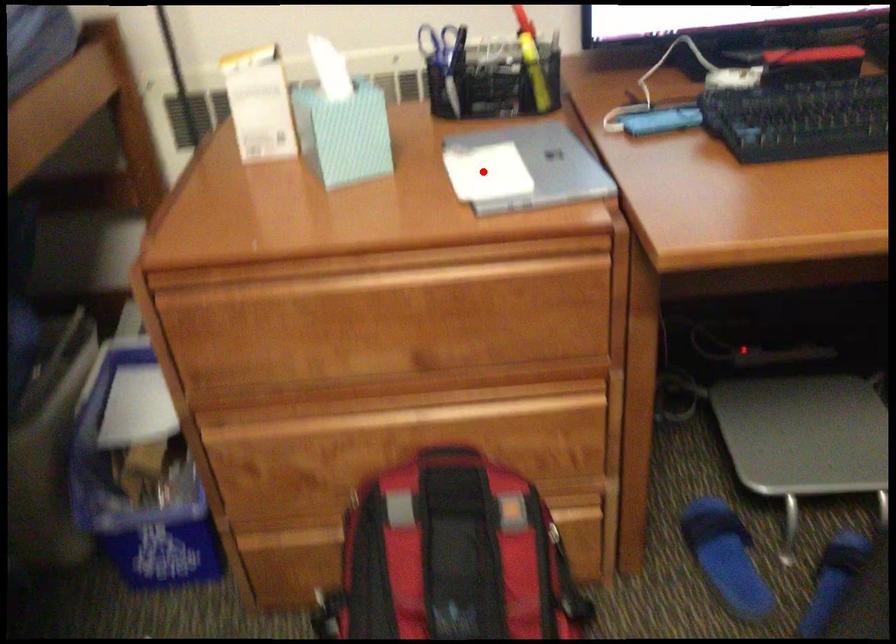
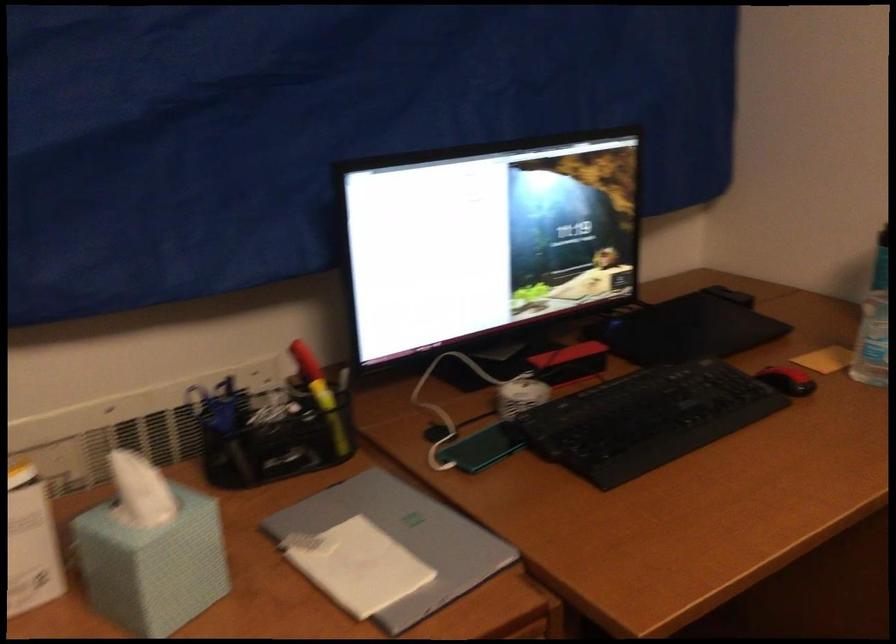
The point at the highlighted location is marked in the first image. Where is the corresponding point in the second image?

(357, 565)